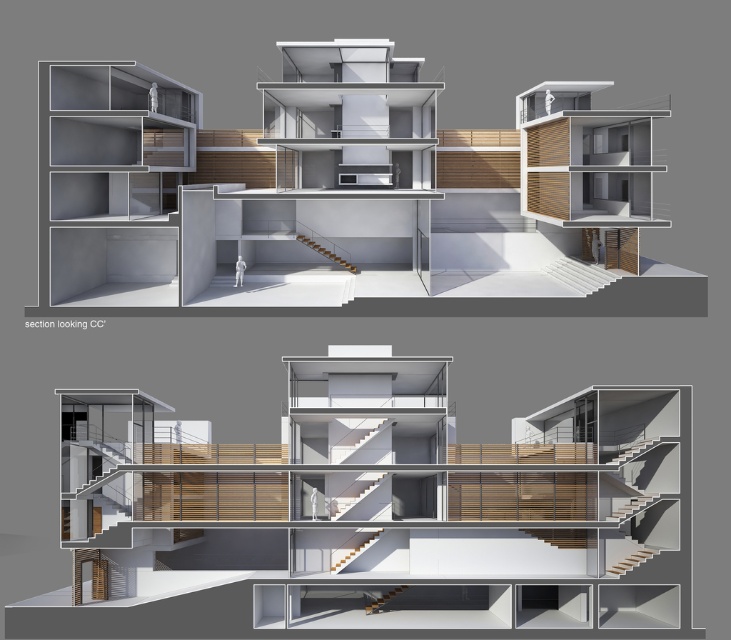
Does white glossy stairs at center appear under wooden stairs at center?

Indeed, white glossy stairs at center is positioned under wooden stairs at center.

Between white glossy stairs at center and wooden stairs at center, which one is positioned higher?

wooden stairs at center is above.

Describe the element at coordinates (579, 275) in the screenshot. I see `white glossy stairs at center` at that location.

Locate an element on the screen. The width and height of the screenshot is (731, 640). white glossy stairs at center is located at coordinates (579, 275).